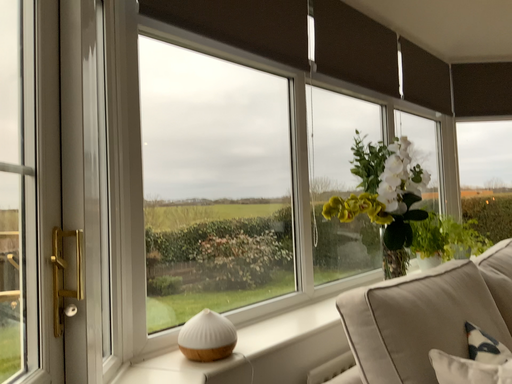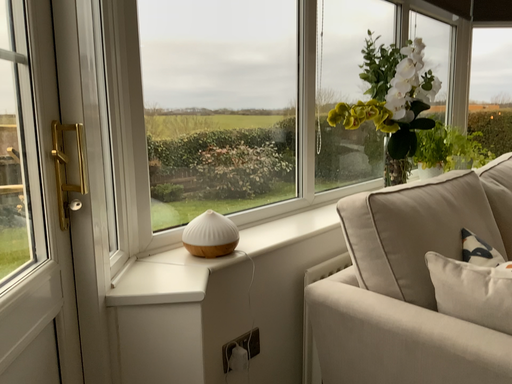
Question: Which way did the camera rotate in the video?

Choices:
 (A) rotated downward
 (B) rotated upward

Answer: (A)